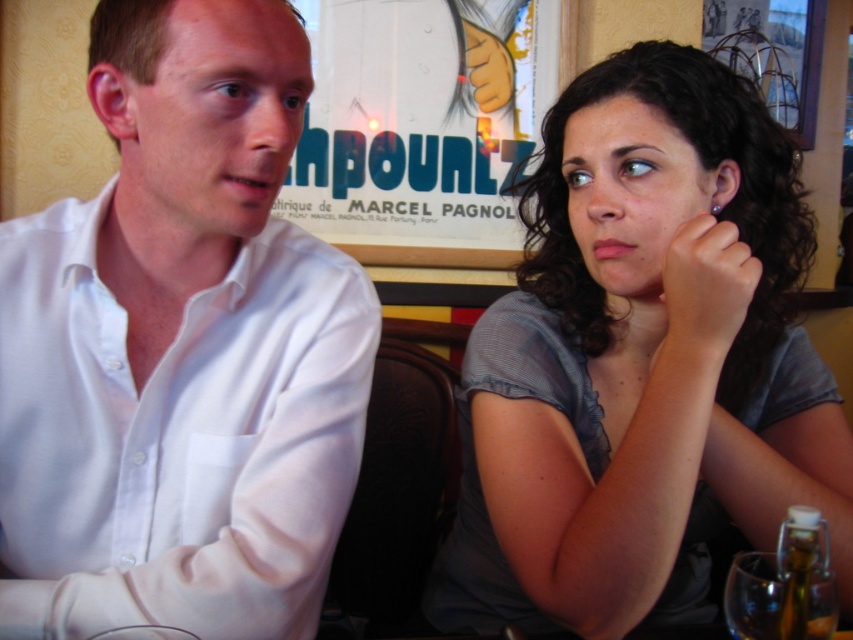
Question: Which of the following is the closest to the observer?

Choices:
 (A) (30, 314)
 (B) (672, 138)

Answer: (A)

Question: Which object appears farthest from the camera in this image?

Choices:
 (A) gray sheer blouse at upper right
 (B) white smooth shirt at left

Answer: (A)

Question: Which of the following is the closest to the observer?

Choices:
 (A) (700, 374)
 (B) (109, 202)

Answer: (A)

Question: Does white smooth shirt at left appear on the left side of gray sheer blouse at upper right?

Choices:
 (A) no
 (B) yes

Answer: (B)

Question: Is white smooth shirt at left smaller than gray sheer blouse at upper right?

Choices:
 (A) yes
 (B) no

Answer: (A)

Question: Is white smooth shirt at left to the left of gray sheer blouse at upper right from the viewer's perspective?

Choices:
 (A) no
 (B) yes

Answer: (B)